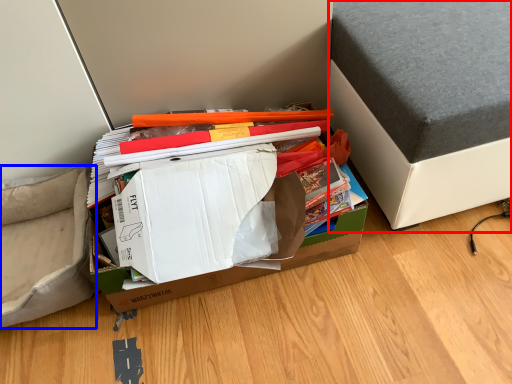
Question: Which object appears closest to the camera in this image, furniture (highlighted by a red box) or armchair (highlighted by a blue box)?

Choices:
 (A) furniture
 (B) armchair

Answer: (A)